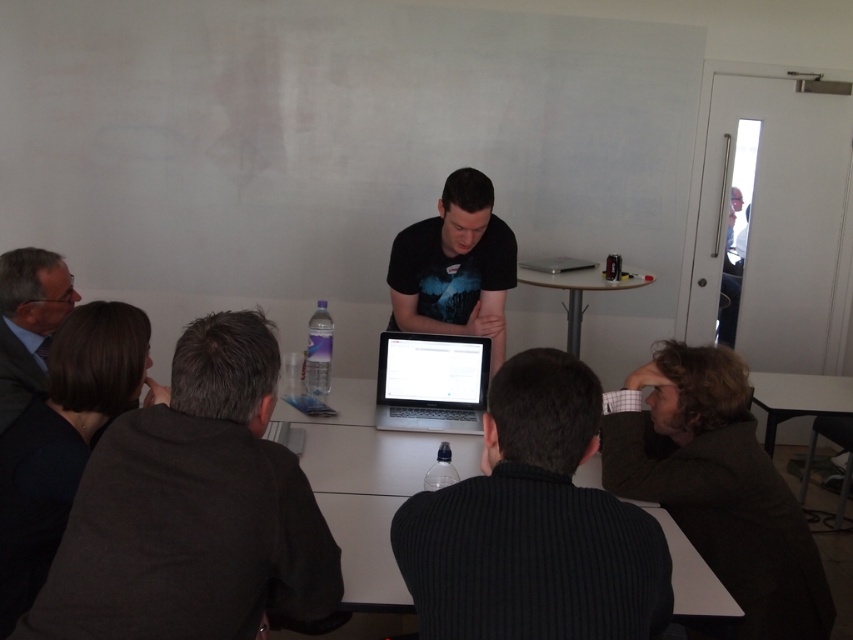
You are organizing a small workshop and need to place a 1.2 meter wide whiteboard easel on the white glossy table at center. Considering the dark gray ribbed sweater at center is already on the table, can the easel fit on the table without overlapping the sweater?

The dark gray ribbed sweater at center is narrower than the white glossy table at center. Since the sweater is less wide than the table, there should be enough space to place the 1.2 meter wide easel on the white glossy table at center without overlapping the sweater.

In the scene shown: You are a person standing at the back of the room and want to see the laptop screen clearly. Which table should you move closer to, the white glossy table at lower right or the white glossy table at center?

You should move closer to the white glossy table at center because the white glossy table at lower right is positioned under it, making it harder to see the laptop screen from the back.

You are a participant in the meeting and want to place a notebook on the dark gray sweater at lower left. Can you do this without moving the white glossy table at center?

The dark gray sweater at lower left is below the white glossy table at center, so placing the notebook on the sweater would require moving the table to access it.